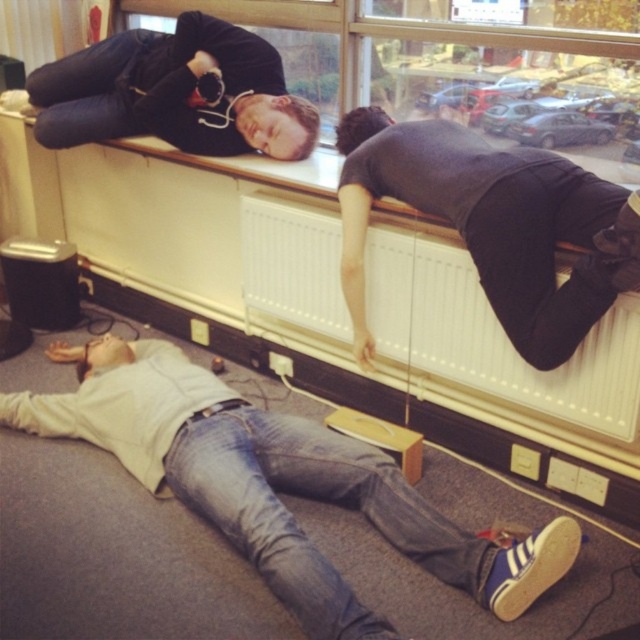
Question: Can you confirm if white matte shirt at lower left is bigger than dark gray shirt at upper center?

Choices:
 (A) yes
 (B) no

Answer: (A)

Question: Which of the following is the farthest from the observer?

Choices:
 (A) white matte shirt at lower left
 (B) white textured radiator at upper center
 (C) matte black laptop at upper center

Answer: (C)

Question: Is white matte shirt at lower left behind matte black laptop at upper center?

Choices:
 (A) yes
 (B) no

Answer: (B)

Question: Based on their relative distances, which object is nearer to the dark gray shirt at upper center?

Choices:
 (A) white textured radiator at upper center
 (B) white matte shirt at lower left
 (C) matte black laptop at upper center

Answer: (A)

Question: Which point is farther to the camera?

Choices:
 (A) dark gray shirt at upper center
 (B) white textured radiator at upper center

Answer: (B)

Question: Can you confirm if dark gray shirt at upper center is positioned to the right of matte black laptop at upper center?

Choices:
 (A) yes
 (B) no

Answer: (A)